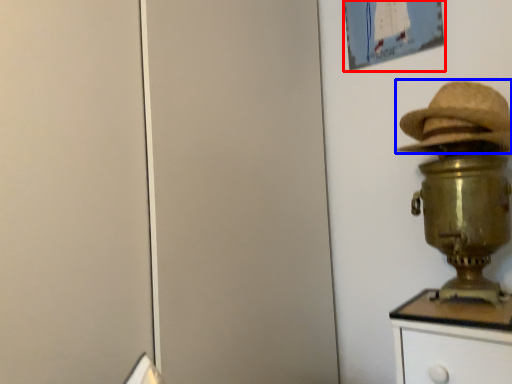
Question: Among these objects, which one is farthest to the camera, picture frame (highlighted by a red box) or hat (highlighted by a blue box)?

Choices:
 (A) picture frame
 (B) hat

Answer: (A)